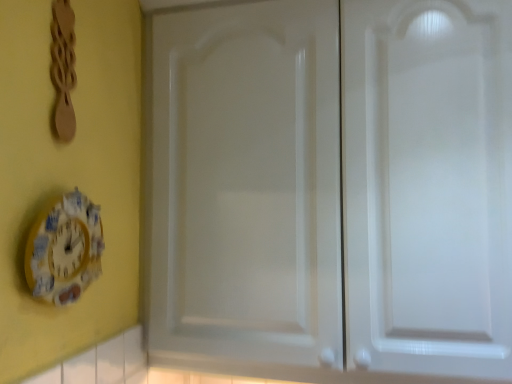
Question: From a real-world perspective, does yellow painted wood clock at lower left sit lower than white glossy cabinet doors at center?

Choices:
 (A) yes
 (B) no

Answer: (A)

Question: Would you say yellow painted wood clock at lower left is outside white glossy cabinet doors at center?

Choices:
 (A) yes
 (B) no

Answer: (A)

Question: From the image's perspective, is yellow painted wood clock at lower left on top of white glossy cabinet doors at center?

Choices:
 (A) yes
 (B) no

Answer: (B)

Question: Is yellow painted wood clock at lower left in front of white glossy cabinet doors at center?

Choices:
 (A) yes
 (B) no

Answer: (A)

Question: Can you confirm if yellow painted wood clock at lower left is thinner than white glossy cabinet doors at center?

Choices:
 (A) no
 (B) yes

Answer: (B)

Question: Is yellow painted wood clock at lower left behind white glossy cabinet doors at center?

Choices:
 (A) yes
 (B) no

Answer: (B)

Question: Considering the relative sizes of yellow painted wood clock at lower left and wooden spoon at upper left in the image provided, is yellow painted wood clock at lower left bigger than wooden spoon at upper left?

Choices:
 (A) no
 (B) yes

Answer: (B)

Question: From the image's perspective, is yellow painted wood clock at lower left below wooden spoon at upper left?

Choices:
 (A) no
 (B) yes

Answer: (B)

Question: Is yellow painted wood clock at lower left wider than wooden spoon at upper left?

Choices:
 (A) yes
 (B) no

Answer: (A)

Question: Is yellow painted wood clock at lower left aimed at wooden spoon at upper left?

Choices:
 (A) no
 (B) yes

Answer: (A)

Question: Is yellow painted wood clock at lower left behind wooden spoon at upper left?

Choices:
 (A) no
 (B) yes

Answer: (A)

Question: Is yellow painted wood clock at lower left touching wooden spoon at upper left?

Choices:
 (A) no
 (B) yes

Answer: (A)

Question: Can we say wooden spoon at upper left lies outside white glossy cabinet doors at center?

Choices:
 (A) no
 (B) yes

Answer: (B)